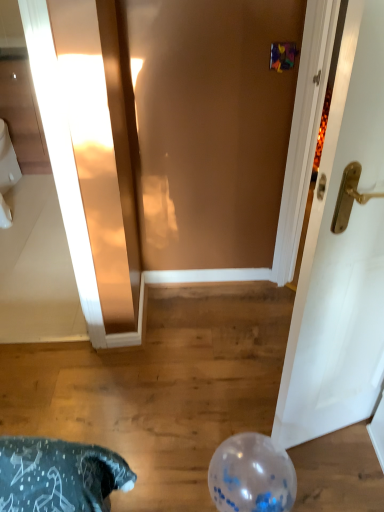
Locate an element on the screen. free space to the left of transparent plastic balloon at lower center is located at coordinates (184, 470).